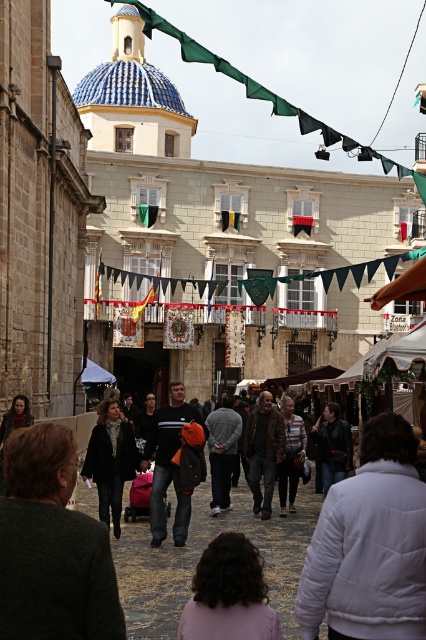
Does pink fabric at lower center have a greater width compared to dark gray fabric crowd at center?

No, pink fabric at lower center is not wider than dark gray fabric crowd at center.

Between pink fabric at lower center and dark gray fabric crowd at center, which one is positioned higher?

Positioned higher is pink fabric at lower center.

Who is more forward, [233,605] or [163,492]?

Point [233,605]

Locate an element on the screen. This screenshot has height=640, width=426. pink fabric at lower center is located at coordinates (229, 595).

Can you confirm if white puffy jacket at lower right is positioned to the left of dark brown leather jacket at center?

Incorrect, white puffy jacket at lower right is not on the left side of dark brown leather jacket at center.

Who is positioned more to the left, white puffy jacket at lower right or dark brown leather jacket at center?

dark brown leather jacket at center is more to the left.

Image resolution: width=426 pixels, height=640 pixels. In order to click on white puffy jacket at lower right in this screenshot , I will do `click(370, 545)`.

Is white puffy jacket at lower right smaller than dark gray sweater at center?

Yes, white puffy jacket at lower right is smaller than dark gray sweater at center.

Does white puffy jacket at lower right appear under dark gray sweater at center?

No.

Is point (408, 477) behind point (155, 460)?

No, (408, 477) is closer to viewer.

The height and width of the screenshot is (640, 426). I want to click on white puffy jacket at lower right, so click(370, 545).